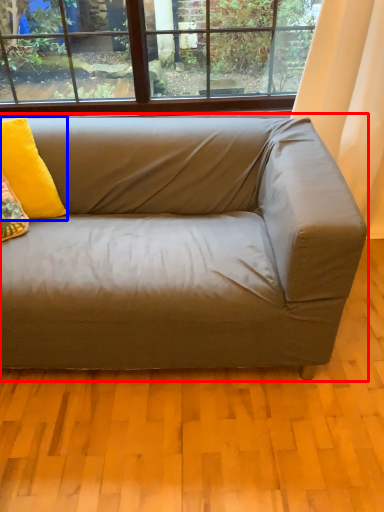
Question: Among these objects, which one is nearest to the camera, studio couch (highlighted by a red box) or pillow (highlighted by a blue box)?

Choices:
 (A) studio couch
 (B) pillow

Answer: (A)